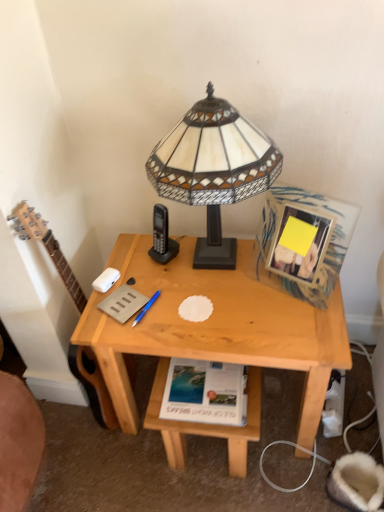
Where is `free spot to the left of wooden picture frame at upper right`? The image size is (384, 512). free spot to the left of wooden picture frame at upper right is located at coordinates (245, 289).